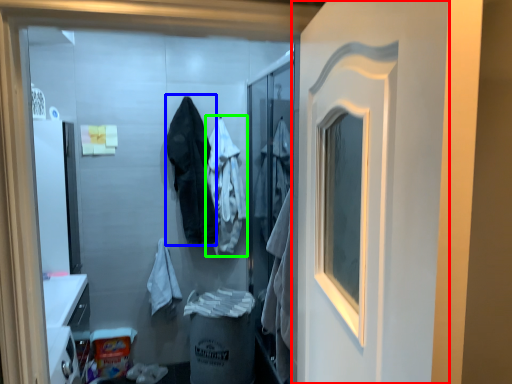
Question: Which is nearer to the door (highlighted by a red box)? clothing (highlighted by a blue box) or clothing (highlighted by a green box).

Choices:
 (A) clothing
 (B) clothing

Answer: (A)